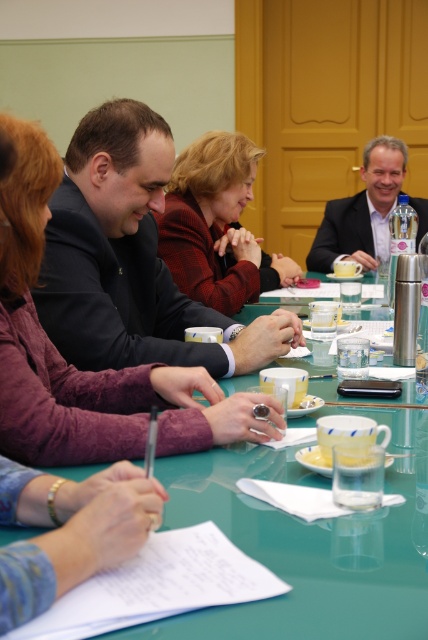
You are standing at the end of the conference table and want to reach both the point at coordinates (219, 352) and the point at coordinates (238, 148). Which point should you approach first to minimize walking distance?

You should approach the point at coordinates (219, 352) first because it is closer to you than the point at coordinates (238, 148).

You are organizing a meeting and need to place a large document on the green glass table at center and the matte black suit at upper right. Which surface can accommodate the document better?

The matte black suit at upper right can accommodate the document better since it is larger than the green glass table at center.

You are a photographer taking a picture of the group at the conference table. You want to ensure both the black suit at center and the red woolen sweater at center are clearly visible. Which one should you focus on first to ensure proper depth of field?

The black suit at center is located below the red woolen sweater at center. Since it is closer to the camera, you should focus on the black suit at center first to ensure both are in focus.